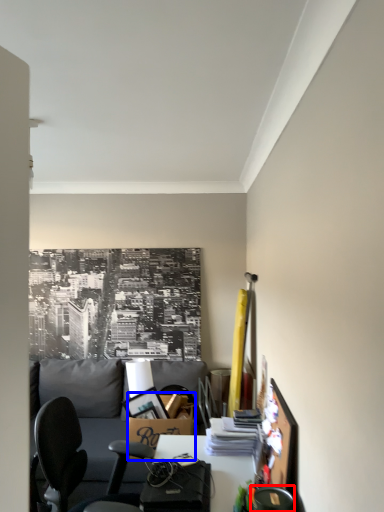
Question: Among these objects, which one is farthest to the camera, chair (highlighted by a red box) or box (highlighted by a blue box)?

Choices:
 (A) chair
 (B) box

Answer: (B)